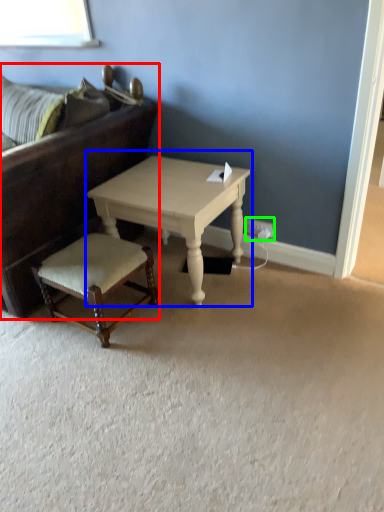
Question: Based on their relative distances, which object is farther from studio couch (highlighted by a red box)? Choose from coffee table (highlighted by a blue box) and electric outlet (highlighted by a green box).

Choices:
 (A) coffee table
 (B) electric outlet

Answer: (B)